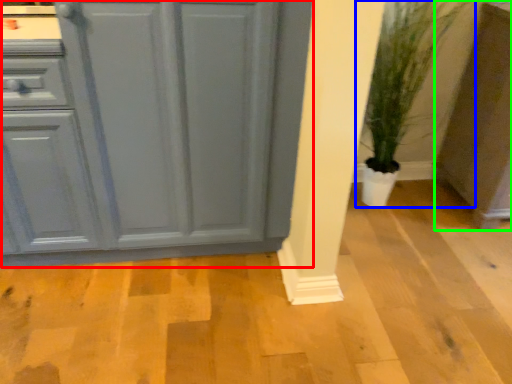
Question: Which object is the closest to the cabinetry (highlighted by a red box)? Choose among these: houseplant (highlighted by a blue box) or cabinetry (highlighted by a green box).

Choices:
 (A) houseplant
 (B) cabinetry

Answer: (A)